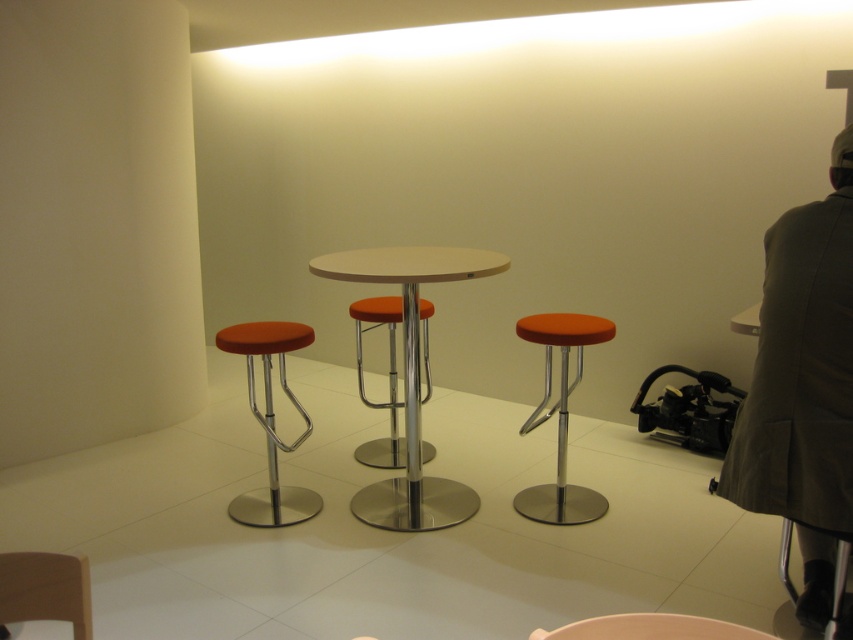
Does orange fabric stool at center have a greater height compared to matte orange stool at center?

Correct, orange fabric stool at center is much taller as matte orange stool at center.

Who is more distant from viewer, (544, 317) or (770, 634)?

The point (544, 317) is more distant.

The height and width of the screenshot is (640, 853). Identify the location of orange fabric stool at center. (560, 417).

Can you confirm if white glossy table at center is taller than orange fabric stool at center?

Correct, white glossy table at center is much taller as orange fabric stool at center.

Can you confirm if white glossy table at center is wider than orange fabric stool at center?

Yes, white glossy table at center is wider than orange fabric stool at center.

Does point (397, 252) come in front of point (566, 445)?

Yes, point (397, 252) is closer to viewer.

Locate an element on the screen. The height and width of the screenshot is (640, 853). white glossy table at center is located at coordinates (410, 380).

Which of these two, orange fabric stool at center or wooden chair at lower left, stands taller?

With more height is orange fabric stool at center.

The image size is (853, 640). Identify the location of orange fabric stool at center. (560, 417).

The width and height of the screenshot is (853, 640). In order to click on orange fabric stool at center in this screenshot , I will do `click(560, 417)`.